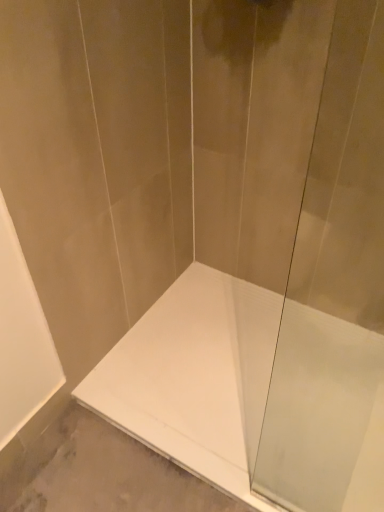
At what (x,y) coordinates should I click in order to perform the action: click on white glossy bathtub at center. Please return your answer as a coordinate pair (x, y). The image size is (384, 512). Looking at the image, I should click on (252, 392).

This screenshot has height=512, width=384. Describe the element at coordinates (252, 392) in the screenshot. I see `white glossy bathtub at center` at that location.

Describe the element at coordinates (335, 295) in the screenshot. The width and height of the screenshot is (384, 512). I see `transparent glass shower door at center` at that location.

Where is `transparent glass shower door at center`? The height and width of the screenshot is (512, 384). transparent glass shower door at center is located at coordinates (335, 295).

Where is `white glossy bathtub at center`? white glossy bathtub at center is located at coordinates (252, 392).

Considering the relative positions of white glossy bathtub at center and transparent glass shower door at center in the image provided, is white glossy bathtub at center to the left of transparent glass shower door at center from the viewer's perspective?

Correct, you'll find white glossy bathtub at center to the left of transparent glass shower door at center.

Does white glossy bathtub at center come behind transparent glass shower door at center?

Yes, it is behind transparent glass shower door at center.

Which is less distant, (205, 302) or (296, 383)?

Point (205, 302).

From the image's perspective, relative to transparent glass shower door at center, is white glossy bathtub at center above or below?

Clearly, from the image's perspective, white glossy bathtub at center is below transparent glass shower door at center.

From a real-world perspective, which object stands above the other?

transparent glass shower door at center.

In terms of width, does white glossy bathtub at center look wider or thinner when compared to transparent glass shower door at center?

Considering their sizes, white glossy bathtub at center looks broader than transparent glass shower door at center.

Can you confirm if white glossy bathtub at center is shorter than transparent glass shower door at center?

Correct, white glossy bathtub at center is not as tall as transparent glass shower door at center.

Does white glossy bathtub at center have a larger size compared to transparent glass shower door at center?

Yes.

Is white glossy bathtub at center surrounding transparent glass shower door at center?

That's incorrect, transparent glass shower door at center is not inside white glossy bathtub at center.

Is white glossy bathtub at center far away from transparent glass shower door at center?

That's not correct — white glossy bathtub at center is a little close to transparent glass shower door at center.

Could you tell me if white glossy bathtub at center is turned towards transparent glass shower door at center?

No, white glossy bathtub at center is not turned towards transparent glass shower door at center.

How many degrees apart are the facing directions of white glossy bathtub at center and transparent glass shower door at center?

90.7 degrees separate the facing orientations of white glossy bathtub at center and transparent glass shower door at center.

Find the location of a particular element. Image resolution: width=384 pixels, height=512 pixels. bathtub behind the transparent glass shower door at center is located at coordinates tap(252, 392).

Considering the positions of objects transparent glass shower door at center and white glossy bathtub at center in the image provided, who is more to the left, transparent glass shower door at center or white glossy bathtub at center?

From the viewer's perspective, white glossy bathtub at center appears more on the left side.

Is transparent glass shower door at center in front of or behind white glossy bathtub at center in the image?

transparent glass shower door at center is in front of white glossy bathtub at center.

Which is less distant, (x=362, y=253) or (x=325, y=312)?

Point (x=362, y=253)

From the image's perspective, is transparent glass shower door at center located above white glossy bathtub at center?

Yes, from the image's perspective, transparent glass shower door at center is over white glossy bathtub at center.

From a real-world perspective, who is located lower, transparent glass shower door at center or white glossy bathtub at center?

In real-world perspective, white glossy bathtub at center is lower.

Is transparent glass shower door at center thinner than white glossy bathtub at center?

Indeed, transparent glass shower door at center has a lesser width compared to white glossy bathtub at center.

Between transparent glass shower door at center and white glossy bathtub at center, which one has more height?

transparent glass shower door at center.

Considering the relative sizes of transparent glass shower door at center and white glossy bathtub at center in the image provided, is transparent glass shower door at center bigger than white glossy bathtub at center?

Actually, transparent glass shower door at center might be smaller than white glossy bathtub at center.

Based on the photo, does transparent glass shower door at center contain white glossy bathtub at center?

That's incorrect, white glossy bathtub at center is not inside transparent glass shower door at center.

Is transparent glass shower door at center positioned far away from white glossy bathtub at center?

No, transparent glass shower door at center is in close proximity to white glossy bathtub at center.

Is transparent glass shower door at center aimed at white glossy bathtub at center?

No, transparent glass shower door at center is not facing towards white glossy bathtub at center.

How different are the orientations of transparent glass shower door at center and white glossy bathtub at center in degrees?

There is a 90.7-degree angle between the facing directions of transparent glass shower door at center and white glossy bathtub at center.

Locate an element on the screen. The height and width of the screenshot is (512, 384). bathtub on the left of transparent glass shower door at center is located at coordinates (252, 392).

The width and height of the screenshot is (384, 512). In order to click on bathtub directly beneath the transparent glass shower door at center (from a real-world perspective) in this screenshot , I will do `click(252, 392)`.

The width and height of the screenshot is (384, 512). What are the coordinates of `bathtub below the transparent glass shower door at center (from the image's perspective)` in the screenshot? It's located at (252, 392).